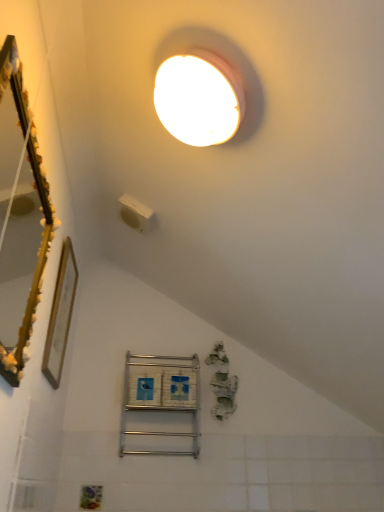
Question: Is gold textured mirror at left a part of gold wooden picture frame at left?

Choices:
 (A) no
 (B) yes

Answer: (A)

Question: Is gold wooden picture frame at left bigger than gold textured mirror at left?

Choices:
 (A) no
 (B) yes

Answer: (A)

Question: From a real-world perspective, is gold wooden picture frame at left over gold textured mirror at left?

Choices:
 (A) yes
 (B) no

Answer: (A)

Question: Considering the relative sizes of gold wooden picture frame at left and gold textured mirror at left in the image provided, is gold wooden picture frame at left wider than gold textured mirror at left?

Choices:
 (A) no
 (B) yes

Answer: (A)

Question: From the image's perspective, would you say gold wooden picture frame at left is positioned over gold textured mirror at left?

Choices:
 (A) no
 (B) yes

Answer: (A)

Question: Are gold wooden picture frame at left and gold textured mirror at left making contact?

Choices:
 (A) no
 (B) yes

Answer: (A)

Question: Would you say white plastic light switch at upper center is a long distance from metallic silver shelf at center?

Choices:
 (A) no
 (B) yes

Answer: (A)

Question: Can you confirm if white plastic light switch at upper center is smaller than metallic silver shelf at center?

Choices:
 (A) yes
 (B) no

Answer: (A)

Question: Is white plastic light switch at upper center shorter than metallic silver shelf at center?

Choices:
 (A) no
 (B) yes

Answer: (B)

Question: Is white plastic light switch at upper center closer to camera compared to metallic silver shelf at center?

Choices:
 (A) yes
 (B) no

Answer: (A)

Question: Is white plastic light switch at upper center to the left of metallic silver shelf at center from the viewer's perspective?

Choices:
 (A) no
 (B) yes

Answer: (B)

Question: Is white plastic light switch at upper center behind metallic silver shelf at center?

Choices:
 (A) no
 (B) yes

Answer: (A)

Question: Does metallic silver shelf at center lie behind white plastic light switch at upper center?

Choices:
 (A) yes
 (B) no

Answer: (A)